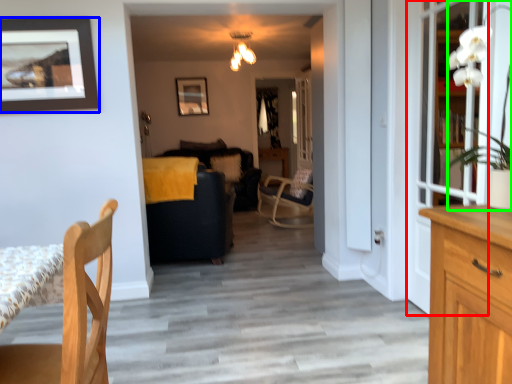
Question: Based on their relative distances, which object is farther from glass door (highlighted by a red box)? Choose from picture frame (highlighted by a blue box) and houseplant (highlighted by a green box).

Choices:
 (A) picture frame
 (B) houseplant

Answer: (A)